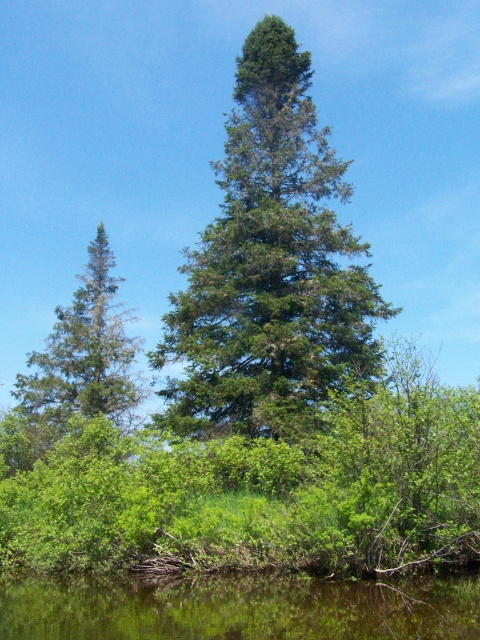
Question: Can you confirm if green needle-like at center is positioned to the left of green reflective water at lower center?

Choices:
 (A) yes
 (B) no

Answer: (B)

Question: Which point is closer to the camera taking this photo?

Choices:
 (A) (206, 289)
 (B) (12, 392)
 (C) (276, 632)

Answer: (C)

Question: Which point is closer to the camera?

Choices:
 (A) (432, 586)
 (B) (97, 401)
 (C) (253, 413)

Answer: (A)

Question: From the image, what is the correct spatial relationship of green needle-like at center in relation to green needle-like at left?

Choices:
 (A) left
 (B) right

Answer: (B)

Question: Which of the following is the closest to the observer?

Choices:
 (A) green needle-like at center
 (B) green needle-like at left

Answer: (B)

Question: Does green reflective water at lower center come behind green needle-like at left?

Choices:
 (A) yes
 (B) no

Answer: (B)